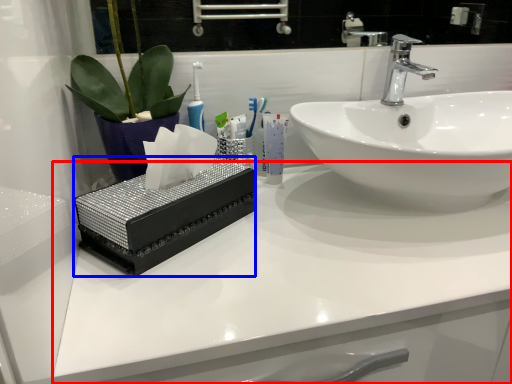
Question: Which object appears farthest to the camera in this image, counter top (highlighted by a red box) or box (highlighted by a blue box)?

Choices:
 (A) counter top
 (B) box

Answer: (B)